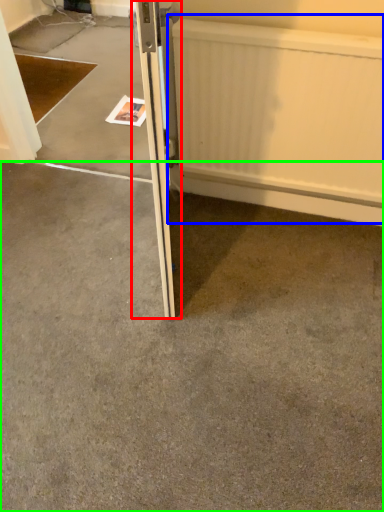
Question: Which object is positioned farthest from door (highlighted by a red box)? Select from radiator (highlighted by a blue box) and concrete (highlighted by a green box).

Choices:
 (A) radiator
 (B) concrete

Answer: (B)